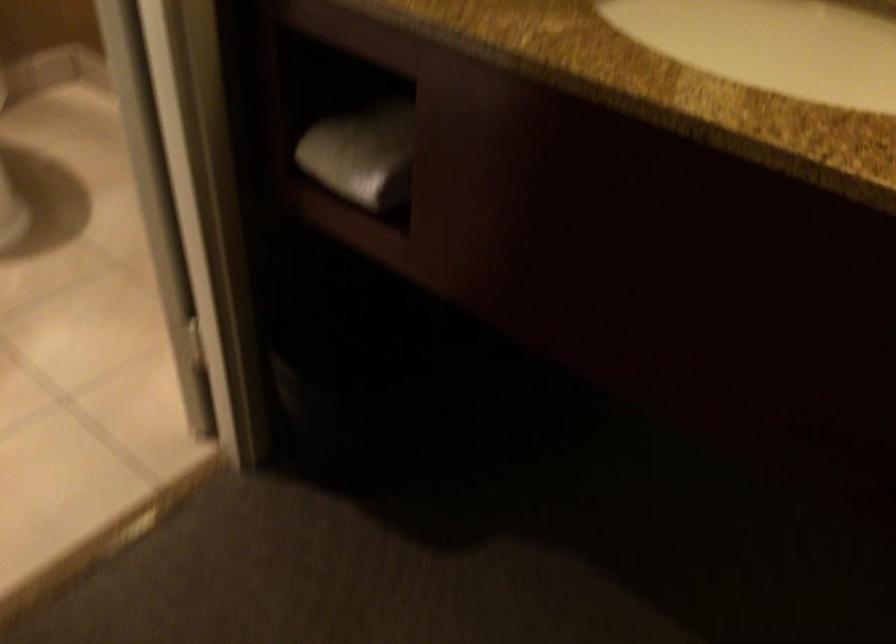
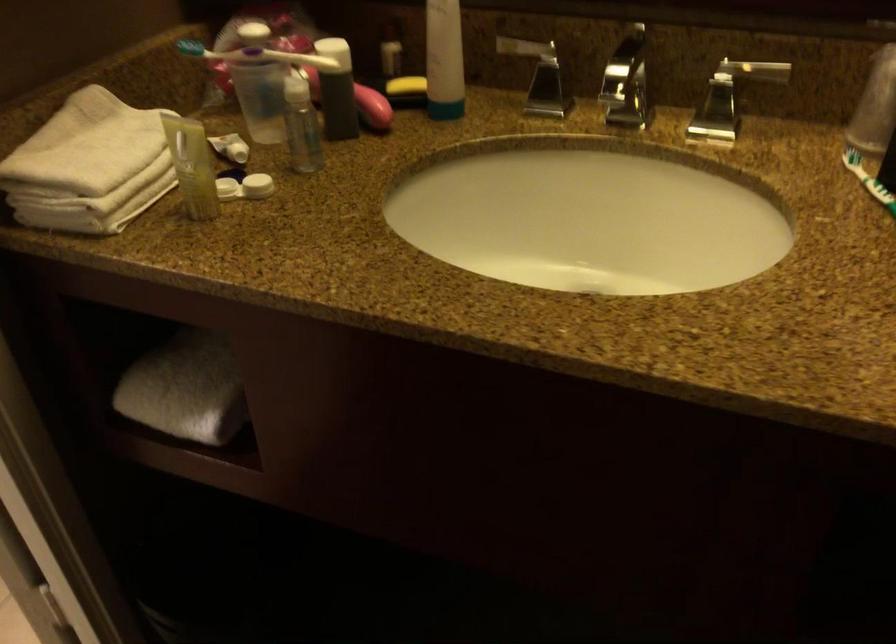
In the second image, find the point that corresponds to point 359,152 in the first image.

(185, 389)